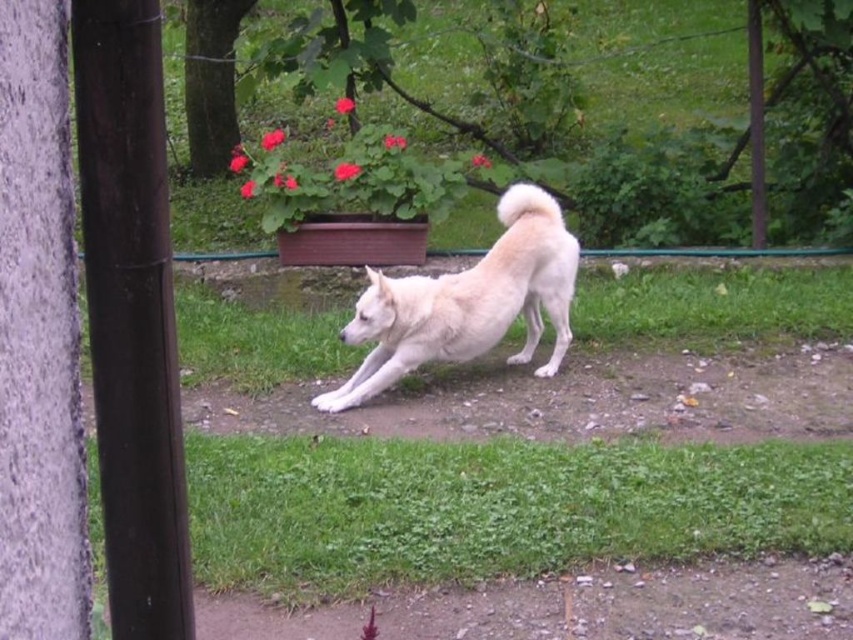
Question: From the image, what is the correct spatial relationship of green grass at lower center in relation to white fluffy dog at center?

Choices:
 (A) below
 (B) above

Answer: (A)

Question: Observing the image, what is the correct spatial positioning of green grass at lower center in reference to white fluffy dog at center?

Choices:
 (A) above
 (B) below

Answer: (B)

Question: Which point is closer to the camera?

Choices:
 (A) white fluffy dog at center
 (B) green grass at lower center

Answer: (B)

Question: Which point is closer to the camera?

Choices:
 (A) (366, 376)
 (B) (306, 545)

Answer: (B)

Question: Does green grass at lower center lie behind white fluffy dog at center?

Choices:
 (A) yes
 (B) no

Answer: (B)